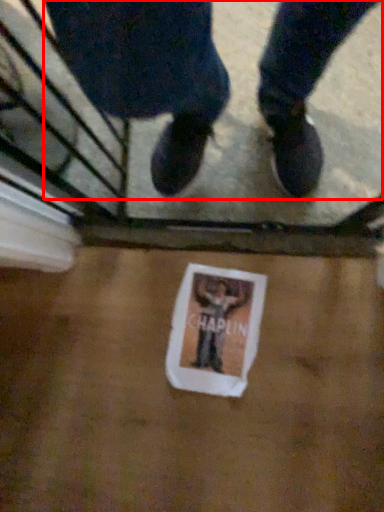
Question: Considering the relative positions of person (annotated by the red box) and flyer in the image provided, where is person (annotated by the red box) located with respect to the staircase?

Choices:
 (A) left
 (B) right

Answer: (B)